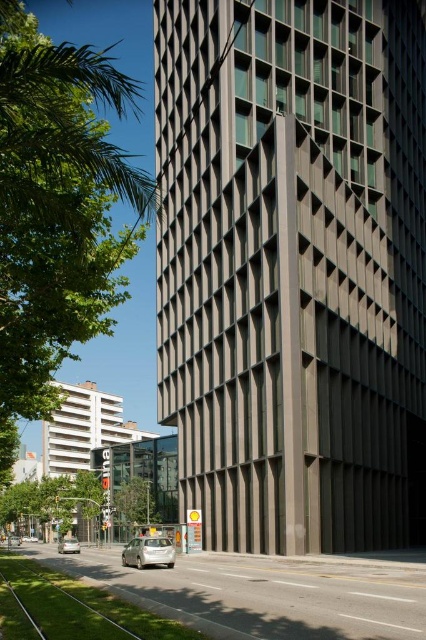
Question: Which point is farther from the camera taking this photo?

Choices:
 (A) (0, 4)
 (B) (74, 541)
 (C) (143, 502)

Answer: (C)

Question: Which object is farther from the camera taking this photo?

Choices:
 (A) silver metallic car at lower left
 (B) green leafy tree at lower center
 (C) silver metallic car at lower center

Answer: (A)

Question: Which object is positioned farthest from the green leafy tree at left?

Choices:
 (A) green leafy tree at lower center
 (B) silver metallic car at lower center

Answer: (B)

Question: Considering the relative positions of silver metallic car at lower center and silver metallic car at lower left in the image provided, where is silver metallic car at lower center located with respect to silver metallic car at lower left?

Choices:
 (A) left
 (B) right

Answer: (B)

Question: Is green leafy tree at lower center bigger than silver metallic car at lower left?

Choices:
 (A) yes
 (B) no

Answer: (A)

Question: Can you confirm if green leafy tree at left is bigger than silver metallic car at lower left?

Choices:
 (A) yes
 (B) no

Answer: (A)